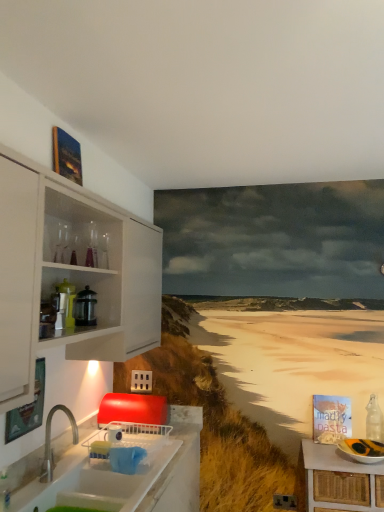
This screenshot has width=384, height=512. Find the location of `empty space that is ontop of white wicker table at lower right (from a real-world perspective)`. empty space that is ontop of white wicker table at lower right (from a real-world perspective) is located at coordinates (354, 445).